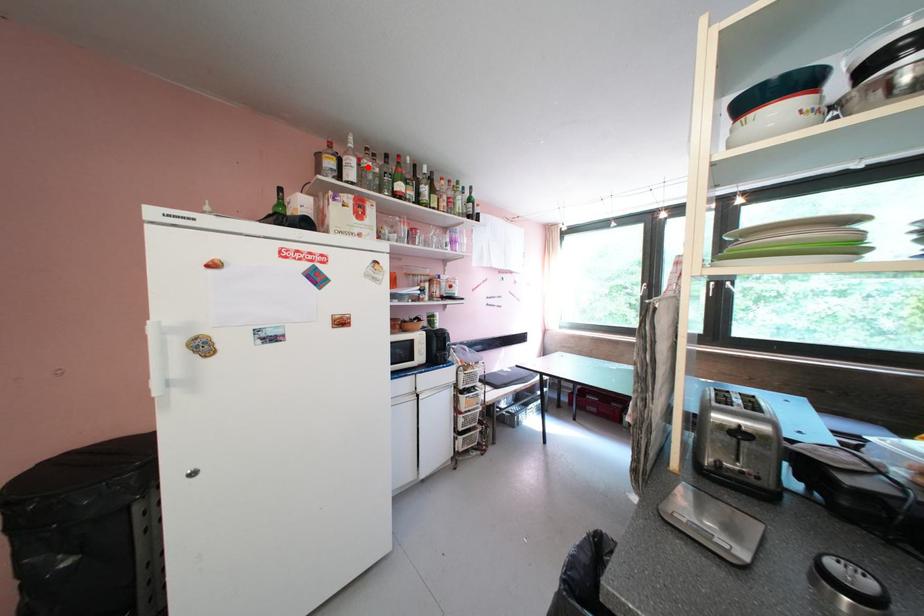
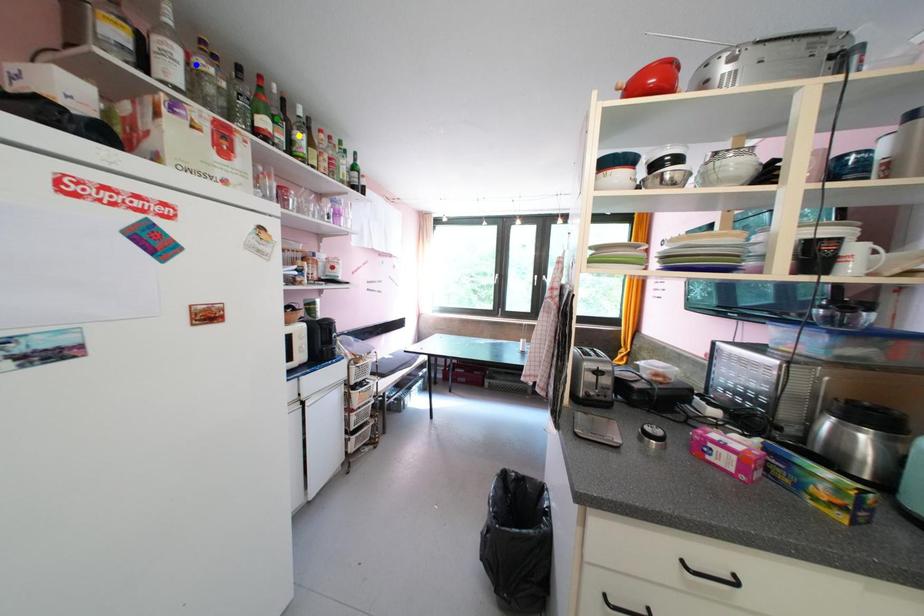
Question: I am providing you with two images of the same scene from different viewpoints. A red point is marked on the first image. You are given multiple points on the second image. Which mark in image 2 goes with the point in image 1?

Choices:
 (A) blue point
 (B) yellow point
 (C) green point

Answer: (A)